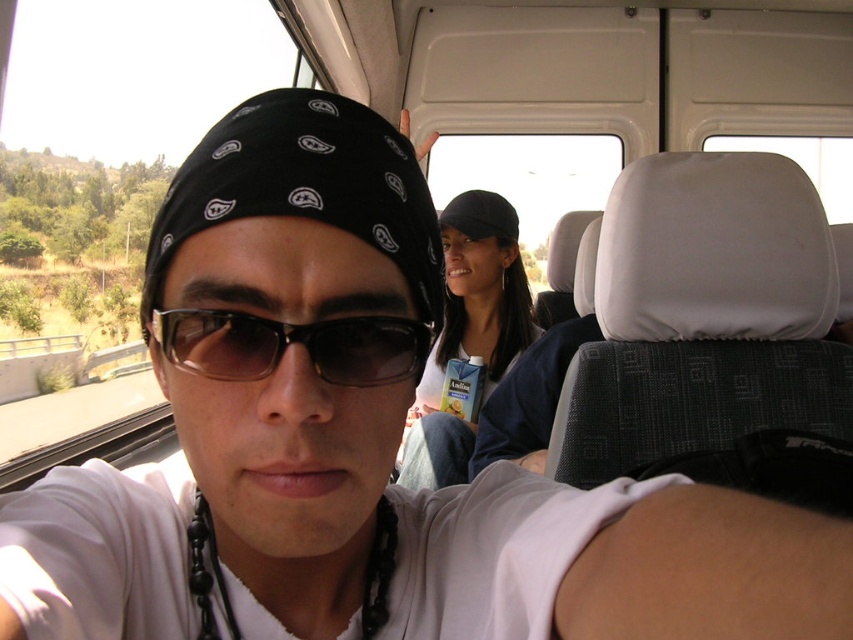
From the picture: You are designing a storage compartment in the vehicle and need to place both the matte black cap at center and the black plastic sunglasses at center. Which object requires more space due to its size?

The matte black cap at center requires more space because it is bigger than the black plastic sunglasses at center.

You are standing 10 feet away from the vehicle and want to reach the point marked at coordinates point (451,280) inside the vehicle. Can you safely walk towards it without overstepping the vehicle?

The distance of point (451,280) from viewer is 7.26 feet, so since you are currently 10 feet away, you need to move forward 2.74 feet to reach it. However, this calculation assumes a straight path which may not account for vehicle dimensions, so ensure you stay within the vehicle boundaries.

You are a delivery robot with a 1.5 meter long package. You need to place the package between the matte black cap at center and the black plastic sunglasses at center. Is there enough space to fit the package between them?

The distance between the matte black cap at center and the black plastic sunglasses at center is 1.60 meters. Since the package is 1.5 meters long, it can fit between them with 0.1 meters of space remaining.